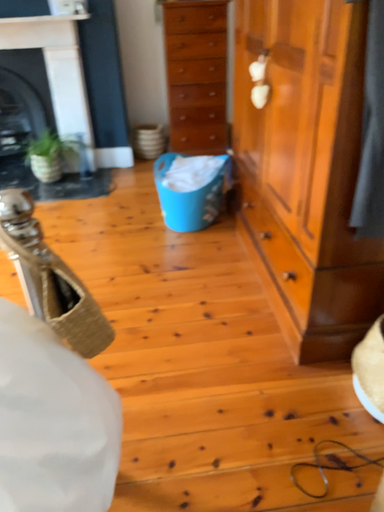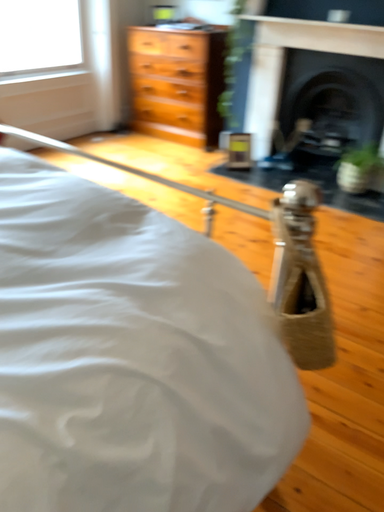
Question: Which way did the camera rotate in the video?

Choices:
 (A) rotated left
 (B) rotated right

Answer: (A)